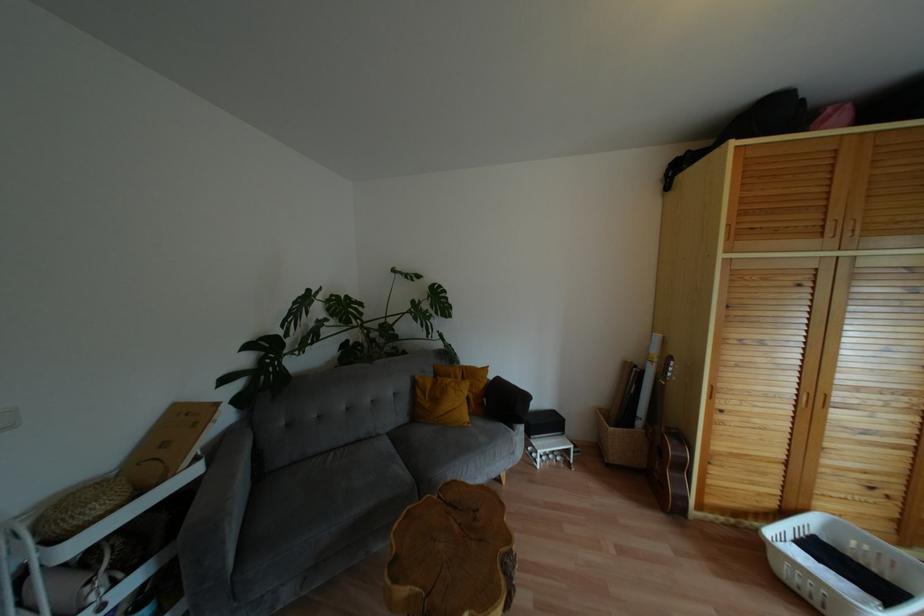
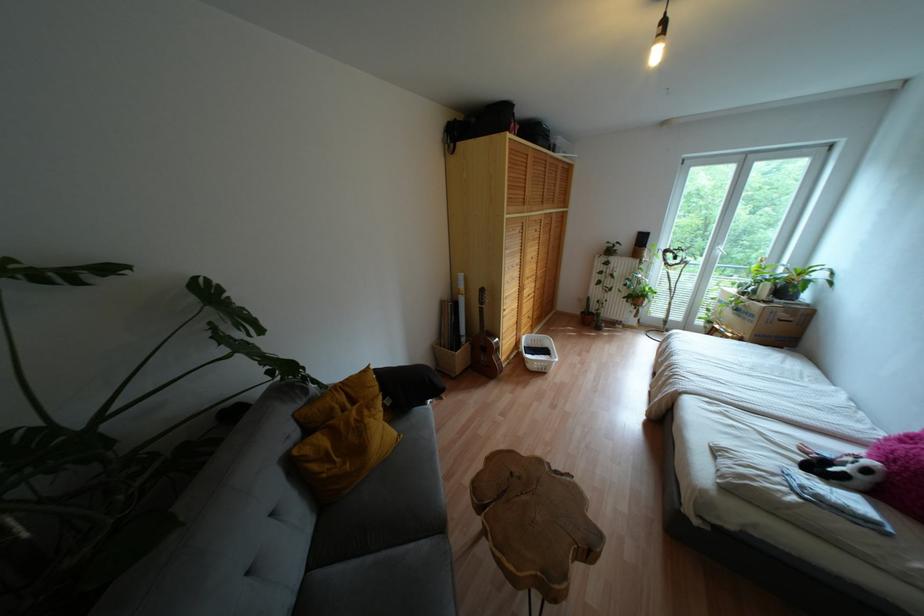
In the second image, find the point that corresponds to [465,371] in the first image.

(348, 391)